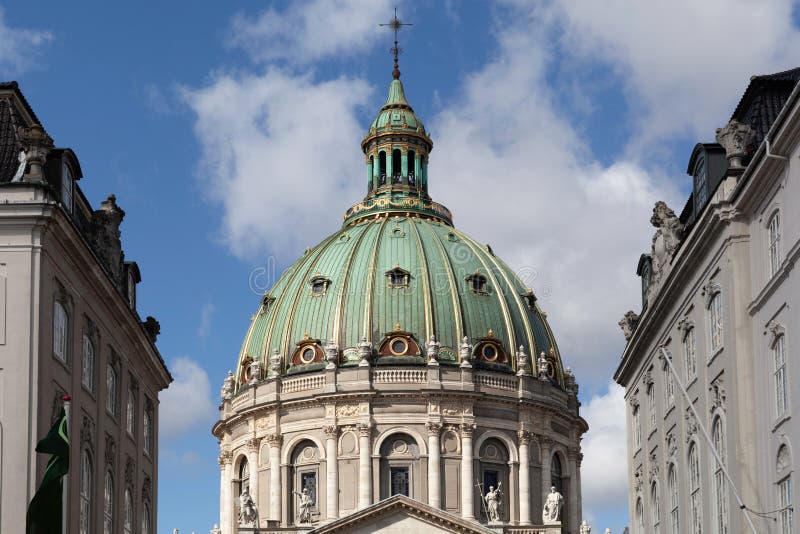
Where is `pillars`? This screenshot has width=800, height=534. pillars is located at coordinates (225, 486), (253, 480), (278, 479), (330, 478), (362, 476), (434, 474), (466, 477), (521, 486).